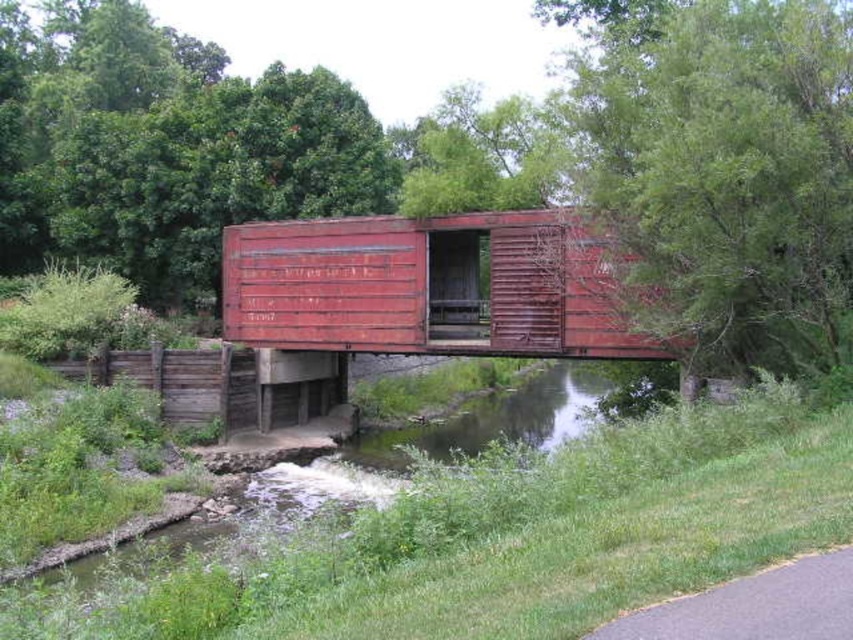
Can you confirm if rusty metal shipping container at center is wider than green grassy river at lower center?

Incorrect, rusty metal shipping container at center's width does not surpass green grassy river at lower center's.

Is rusty metal shipping container at center to the left of green grassy river at lower center from the viewer's perspective?

Indeed, rusty metal shipping container at center is positioned on the left side of green grassy river at lower center.

This screenshot has width=853, height=640. What do you see at coordinates (428, 288) in the screenshot? I see `rusty metal shipping container at center` at bounding box center [428, 288].

Locate an element on the screen. The height and width of the screenshot is (640, 853). rusty metal shipping container at center is located at coordinates (428, 288).